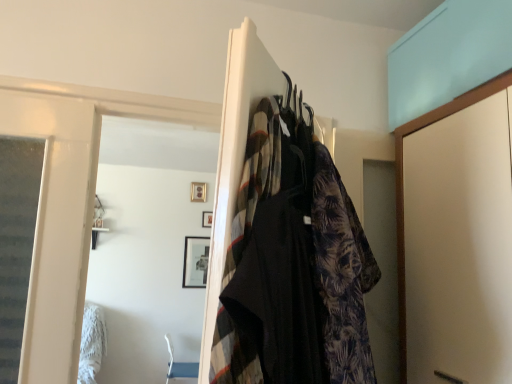
Question: Does printed fabric robe at center turn towards printed fabric dress at center?

Choices:
 (A) yes
 (B) no

Answer: (A)

Question: Does printed fabric robe at center appear on the left side of printed fabric dress at center?

Choices:
 (A) no
 (B) yes

Answer: (A)

Question: Is printed fabric robe at center located outside printed fabric dress at center?

Choices:
 (A) yes
 (B) no

Answer: (A)

Question: Is printed fabric robe at center taller than printed fabric dress at center?

Choices:
 (A) yes
 (B) no

Answer: (A)

Question: Is printed fabric robe at center positioned in front of printed fabric dress at center?

Choices:
 (A) no
 (B) yes

Answer: (A)

Question: Is printed fabric robe at center bigger than printed fabric dress at center?

Choices:
 (A) no
 (B) yes

Answer: (A)

Question: From the image's perspective, is printed fabric dress at center located beneath printed fabric robe at center?

Choices:
 (A) yes
 (B) no

Answer: (B)

Question: Can you confirm if printed fabric dress at center is taller than printed fabric robe at center?

Choices:
 (A) yes
 (B) no

Answer: (B)

Question: Is printed fabric dress at center completely or partially outside of printed fabric robe at center?

Choices:
 (A) yes
 (B) no

Answer: (A)

Question: Considering the relative sizes of printed fabric dress at center and printed fabric robe at center in the image provided, is printed fabric dress at center bigger than printed fabric robe at center?

Choices:
 (A) no
 (B) yes

Answer: (B)

Question: Could you tell me if printed fabric dress at center is turned towards printed fabric robe at center?

Choices:
 (A) no
 (B) yes

Answer: (A)

Question: From a real-world perspective, is printed fabric dress at center below printed fabric robe at center?

Choices:
 (A) yes
 (B) no

Answer: (B)

Question: Considering their positions, is printed fabric dress at center located in front of or behind printed fabric robe at center?

Choices:
 (A) front
 (B) behind

Answer: (A)